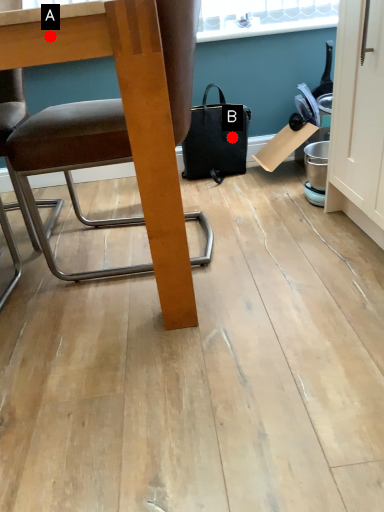
Question: Two points are circled on the image, labeled by A and B beside each circle. Which point is further to the camera?

Choices:
 (A) A is further
 (B) B is further

Answer: (B)